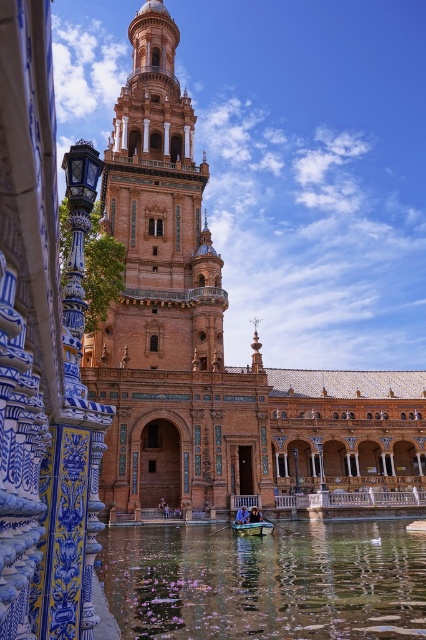
Which of these two, brown textured stone palace at center or clear water at center, stands taller?

With more height is brown textured stone palace at center.

Measure the distance between brown textured stone palace at center and camera.

59.29 meters

Locate an element on the screen. brown textured stone palace at center is located at coordinates (215, 342).

Find the location of a particular element. This screenshot has width=426, height=640. brown textured stone palace at center is located at coordinates (215, 342).

Is brown textured stone palace at center positioned in front of terracotta brick bell tower at center?

Yes.

Between brown textured stone palace at center and terracotta brick bell tower at center, which one is positioned higher?

terracotta brick bell tower at center is above.

Who is more distant from viewer, (152, 348) or (123, 211)?

The point (123, 211) is more distant.

The height and width of the screenshot is (640, 426). Find the location of `brown textured stone palace at center`. brown textured stone palace at center is located at coordinates (215, 342).

Is point (166, 579) positioned in front of point (118, 346)?

Yes, it is.

Which is more to the right, clear water at center or terracotta brick bell tower at center?

From the viewer's perspective, clear water at center appears more on the right side.

Measure the distance between clear water at center and camera.

clear water at center is 101.06 feet from camera.

You are a GUI agent. You are given a task and a screenshot of the screen. Output one action in this format:
    pyautogui.click(x=<x>, y=<y>)
    Task: Click on the clear water at center
    This screenshot has height=640, width=426.
    Given the screenshot: What is the action you would take?
    pyautogui.click(x=265, y=580)